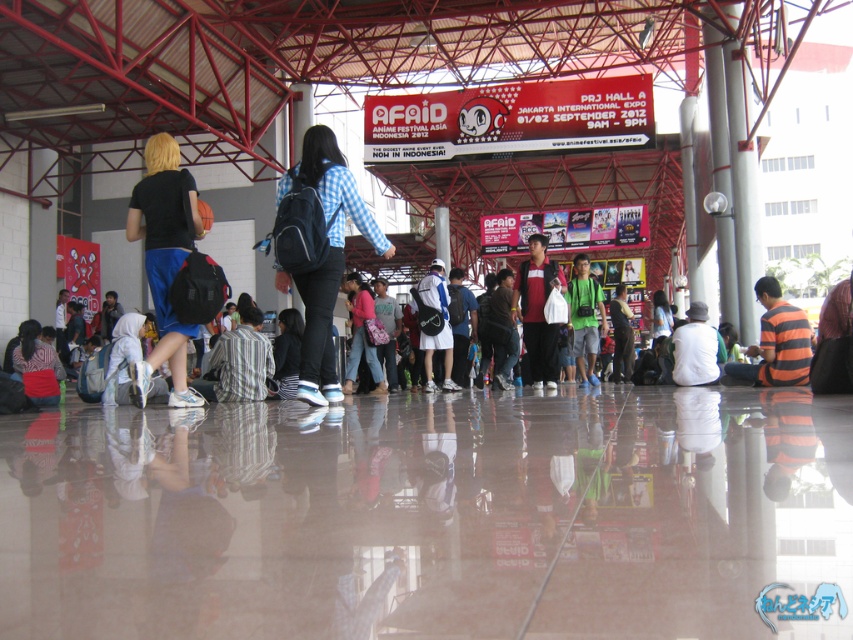
Can you confirm if red fabric bag at lower left is wider than white fabric at lower left?

Yes, red fabric bag at lower left is wider than white fabric at lower left.

Is red fabric bag at lower left positioned at the back of white fabric at lower left?

Yes, red fabric bag at lower left is further from the viewer.

Is point (33, 352) in front of point (151, 392)?

No, (33, 352) is behind (151, 392).

At what (x,y) coordinates should I click in order to perform the action: click on red fabric bag at lower left. Please return your answer as a coordinate pair (x, y). The width and height of the screenshot is (853, 640). Looking at the image, I should click on (38, 365).

Is black matte backpack at left wider than matte black backpack at center?

Correct, the width of black matte backpack at left exceeds that of matte black backpack at center.

Does black matte backpack at left have a smaller size compared to matte black backpack at center?

No, black matte backpack at left is not smaller than matte black backpack at center.

The image size is (853, 640). What are the coordinates of `black matte backpack at left` in the screenshot? It's located at (164, 259).

Locate an element on the screen. black matte backpack at left is located at coordinates (164, 259).

Who is more distant from viewer, (38, 342) or (369, 316)?

The point (38, 342) is more distant.

In the scene shown: How distant is red fabric bag at lower left from pink fabric bag at center?

A distance of 4.84 meters exists between red fabric bag at lower left and pink fabric bag at center.

The width and height of the screenshot is (853, 640). I want to click on red fabric bag at lower left, so click(38, 365).